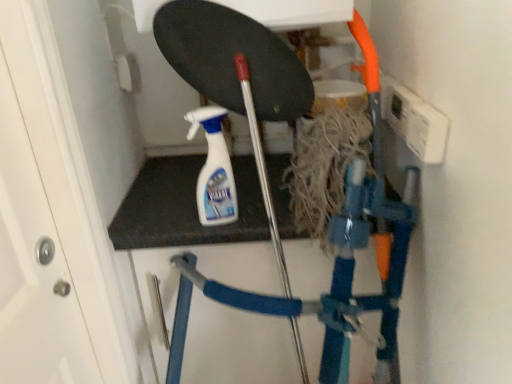
Question: Considering the positions of point (228, 192) and point (348, 274), is point (228, 192) closer or farther from the camera than point (348, 274)?

Choices:
 (A) closer
 (B) farther

Answer: (B)

Question: From their relative heights in the image, would you say white plastic spray bottle at center is taller or shorter than blue plastic ladder at center?

Choices:
 (A) tall
 (B) short

Answer: (B)

Question: Based on their positions, is white plastic spray bottle at center located to the left or right of blue plastic ladder at center?

Choices:
 (A) right
 (B) left

Answer: (B)

Question: Considering the positions of blue plastic ladder at center and white plastic spray bottle at center in the image, is blue plastic ladder at center taller or shorter than white plastic spray bottle at center?

Choices:
 (A) tall
 (B) short

Answer: (A)

Question: Considering the positions of point (330, 357) and point (222, 153), is point (330, 357) closer or farther from the camera than point (222, 153)?

Choices:
 (A) closer
 (B) farther

Answer: (A)

Question: In the image, is blue plastic ladder at center on the left side or the right side of white plastic spray bottle at center?

Choices:
 (A) left
 (B) right

Answer: (B)

Question: Based on their sizes in the image, would you say blue plastic ladder at center is bigger or smaller than white plastic spray bottle at center?

Choices:
 (A) small
 (B) big

Answer: (B)